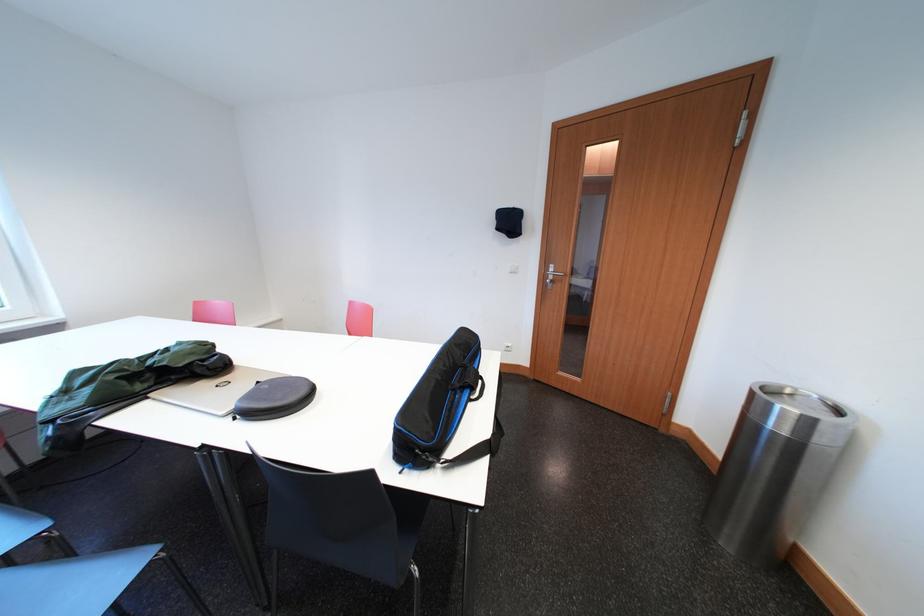
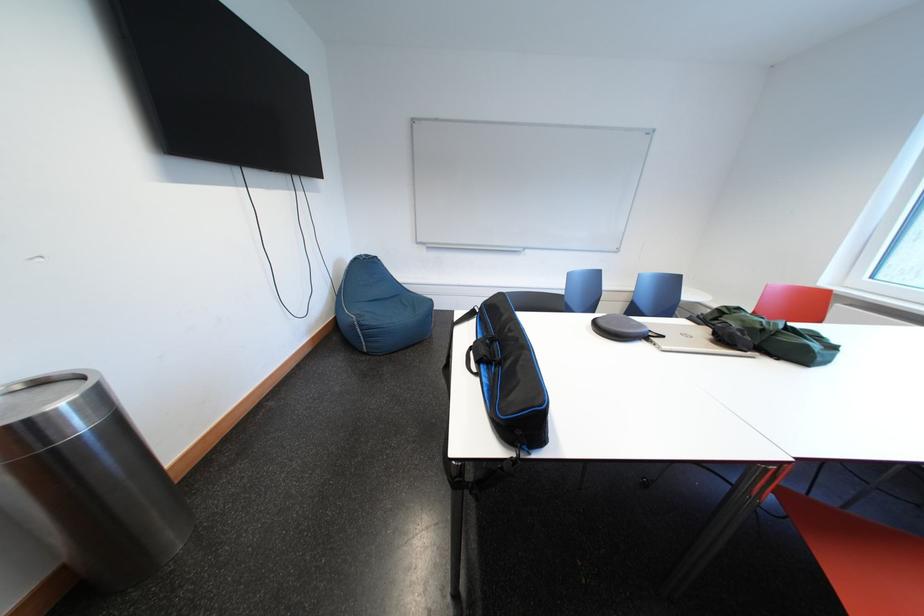
Question: I am providing you with two images of the same scene from different viewpoints. After the viewpoint changes to image2, which objects are now occluded?

Choices:
 (A) black chair sitting surface
 (B) blue beanbag chair
 (C) red chair sitting surface
 (D) red locking lever

Answer: (A)